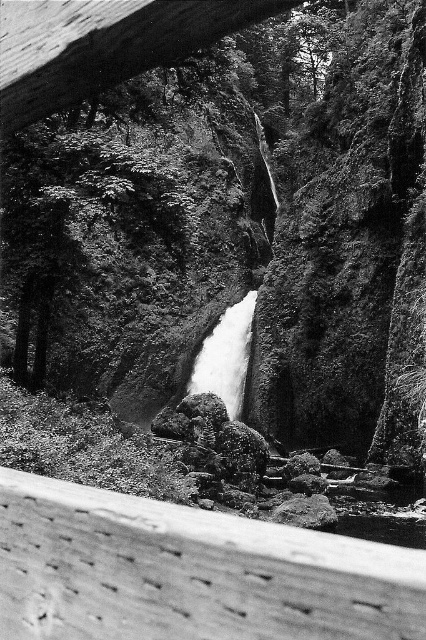
Question: Which object is positioned closest to the wooden beam at upper center?

Choices:
 (A) smooth wooden beam at lower left
 (B) white smooth waterfall at center

Answer: (A)

Question: Which object appears farthest from the camera in this image?

Choices:
 (A) smooth wooden beam at lower left
 (B) white smooth waterfall at center
 (C) wooden beam at upper center

Answer: (B)

Question: Which object appears farthest from the camera in this image?

Choices:
 (A) wooden beam at upper center
 (B) smooth wooden beam at lower left

Answer: (A)

Question: Does smooth wooden beam at lower left appear over wooden beam at upper center?

Choices:
 (A) no
 (B) yes

Answer: (A)

Question: Is smooth wooden beam at lower left bigger than wooden beam at upper center?

Choices:
 (A) yes
 (B) no

Answer: (A)

Question: Can you confirm if smooth wooden beam at lower left is positioned to the right of wooden beam at upper center?

Choices:
 (A) no
 (B) yes

Answer: (B)